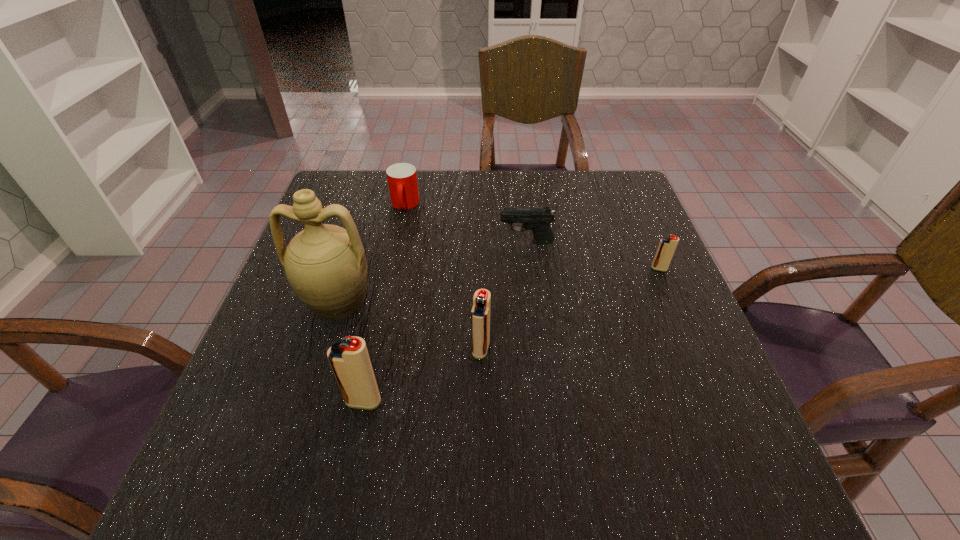
What are the coordinates of `the nearest igniter` in the screenshot? It's located at pos(350,361).

The width and height of the screenshot is (960, 540). What are the coordinates of `the nearest object` in the screenshot? It's located at (350, 361).

Image resolution: width=960 pixels, height=540 pixels. What are the coordinates of `the second nearest igniter` in the screenshot? It's located at (480, 314).

Identify the location of the second shortest igniter. (480, 314).

You are a GUI agent. You are given a task and a screenshot of the screen. Output one action in this format:
    pyautogui.click(x=<x>, y=<y>)
    Task: Click on the farthest igniter
    Image resolution: width=960 pixels, height=540 pixels.
    Given the screenshot: What is the action you would take?
    pyautogui.click(x=667, y=246)

This screenshot has height=540, width=960. I want to click on the rightmost igniter, so [667, 246].

Locate an element on the screen. The height and width of the screenshot is (540, 960). cup is located at coordinates (402, 180).

What are the coordinates of `pistol` in the screenshot? It's located at (537, 219).

Locate an element on the screen. This screenshot has height=540, width=960. the fifth nearest object is located at coordinates (537, 219).

Locate an element on the screen. Image resolution: width=960 pixels, height=540 pixels. the fourth farthest object is located at coordinates (325, 265).